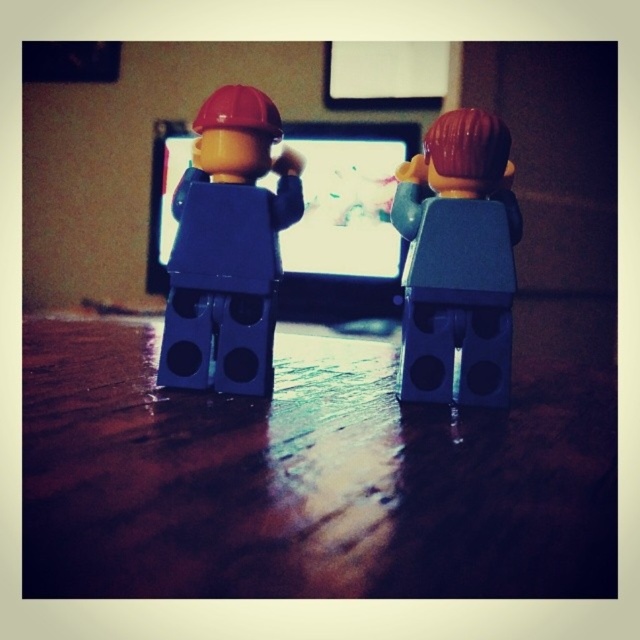
Question: Can you confirm if wooden table at center is positioned above matte gray minifigure at center?

Choices:
 (A) yes
 (B) no

Answer: (B)

Question: Does matte blue minifigure at center have a lesser width compared to matte gray minifigure at center?

Choices:
 (A) yes
 (B) no

Answer: (B)

Question: Which of the following is the closest to the observer?

Choices:
 (A) matte plastic computer screen at center
 (B) matte blue minifigure at center
 (C) wooden table at center
 (D) matte gray minifigure at center

Answer: (C)

Question: Which point is closer to the camera?

Choices:
 (A) wooden table at center
 (B) matte gray minifigure at center
 (C) matte blue minifigure at center

Answer: (A)

Question: Does wooden table at center have a lesser width compared to matte plastic computer screen at center?

Choices:
 (A) yes
 (B) no

Answer: (B)

Question: Which of these objects is positioned farthest from the matte plastic computer screen at center?

Choices:
 (A) matte gray minifigure at center
 (B) wooden table at center

Answer: (A)